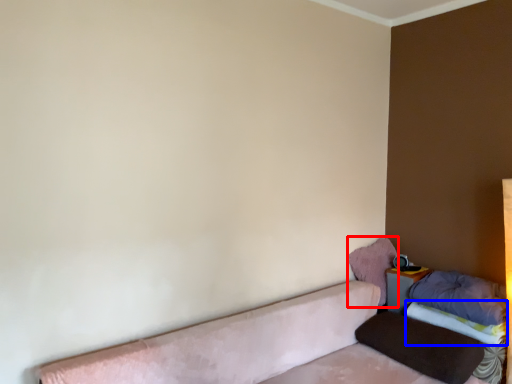
Question: Which point is further to the camera, pillow (highlighted by a red box) or sheet (highlighted by a blue box)?

Choices:
 (A) pillow
 (B) sheet

Answer: (A)